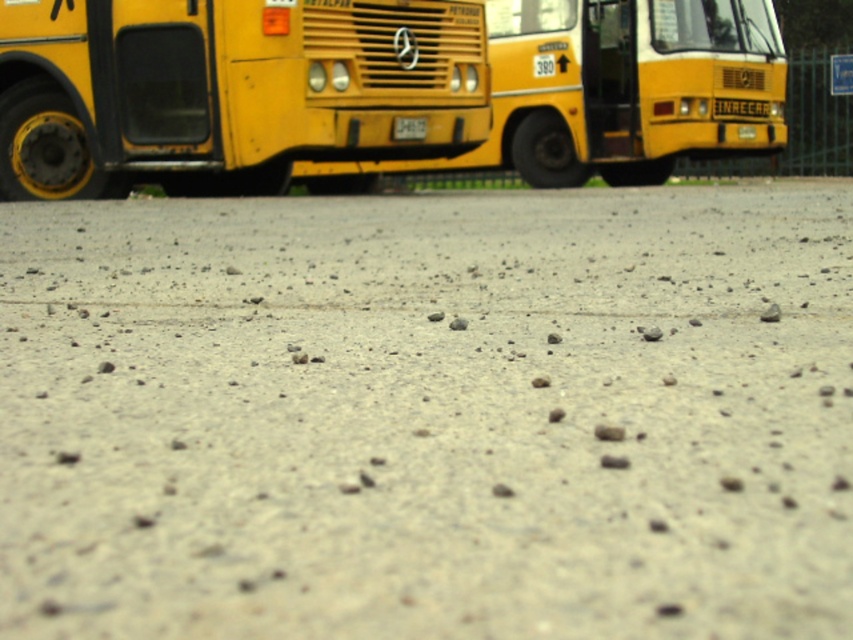
Between point (166, 54) and point (639, 48), which one is positioned behind?

The point (639, 48) is behind.

Between metallic yellow bus at left and yellow matte bus at center, which one appears on the left side from the viewer's perspective?

metallic yellow bus at left is more to the left.

Find the location of `metallic yellow bus at left`. metallic yellow bus at left is located at coordinates (230, 90).

At what (x,y) coordinates should I click in order to perform the action: click on metallic yellow bus at left. Please return your answer as a coordinate pair (x, y). Looking at the image, I should click on (230, 90).